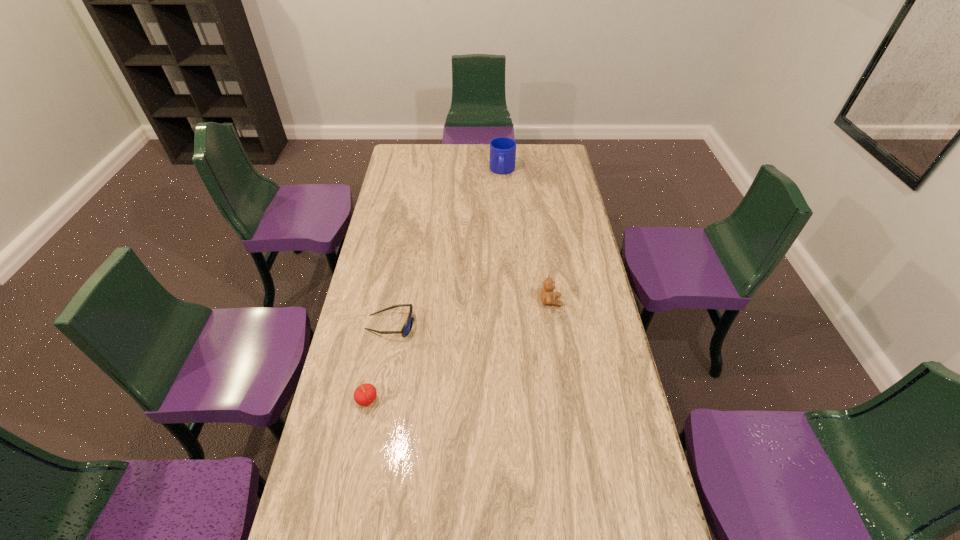
At what (x,y) coordinates should I click in order to perform the action: click on cherry. Please return your answer as a coordinate pair (x, y). This screenshot has height=540, width=960. Looking at the image, I should click on (365, 394).

Locate an element on the screen. The width and height of the screenshot is (960, 540). the rightmost object is located at coordinates (548, 296).

Find the location of a particular element. sunglasses is located at coordinates (408, 324).

Where is `the second object from right to left`? This screenshot has width=960, height=540. the second object from right to left is located at coordinates (502, 149).

You are a GUI agent. You are given a task and a screenshot of the screen. Output one action in this format:
    pyautogui.click(x=<x>, y=<y>)
    Task: Click on the mug
    
    Given the screenshot: What is the action you would take?
    pyautogui.click(x=502, y=149)

This screenshot has height=540, width=960. I want to click on free space located 0.080m on the back of the nearest object, so click(x=373, y=367).

Where is `vacant space located 0.130m on the front-facing side of the rightmost object`? vacant space located 0.130m on the front-facing side of the rightmost object is located at coordinates (598, 301).

The width and height of the screenshot is (960, 540). Find the location of `vacant space located on the front-facing side of the shortest object`. vacant space located on the front-facing side of the shortest object is located at coordinates (432, 329).

Image resolution: width=960 pixels, height=540 pixels. Identify the location of free location located on the front-facing side of the shortest object. (444, 330).

This screenshot has width=960, height=540. I want to click on free region located 0.130m on the front-facing side of the shortest object, so click(452, 330).